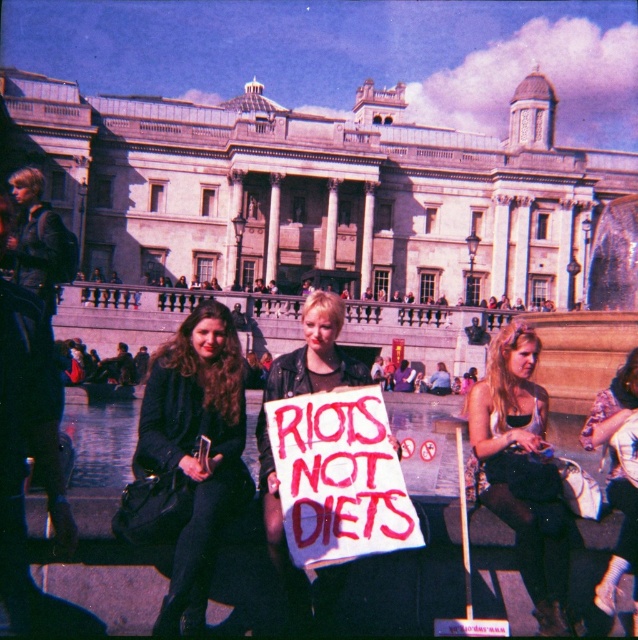
Does point (174, 628) come in front of point (507, 410)?

Yes, it is.

The height and width of the screenshot is (640, 638). In order to click on matte black coat at center in this screenshot , I will do `click(195, 449)`.

Does matte black tank top at center have a lesser height compared to leather jacket at center?

No, matte black tank top at center is not shorter than leather jacket at center.

Can you confirm if matte black tank top at center is thinner than leather jacket at center?

In fact, matte black tank top at center might be wider than leather jacket at center.

Between point (528, 516) and point (632, 465), which one is positioned behind?

Point (632, 465)

Identify the location of matte black tank top at center. This screenshot has height=640, width=638. (523, 472).

Between matte black coat at center and leather jacket at center, which one has less height?

Standing shorter between the two is leather jacket at center.

Which is more to the right, matte black coat at center or leather jacket at center?

Positioned to the right is leather jacket at center.

Locate an element on the screen. This screenshot has height=640, width=638. matte black coat at center is located at coordinates (195, 449).